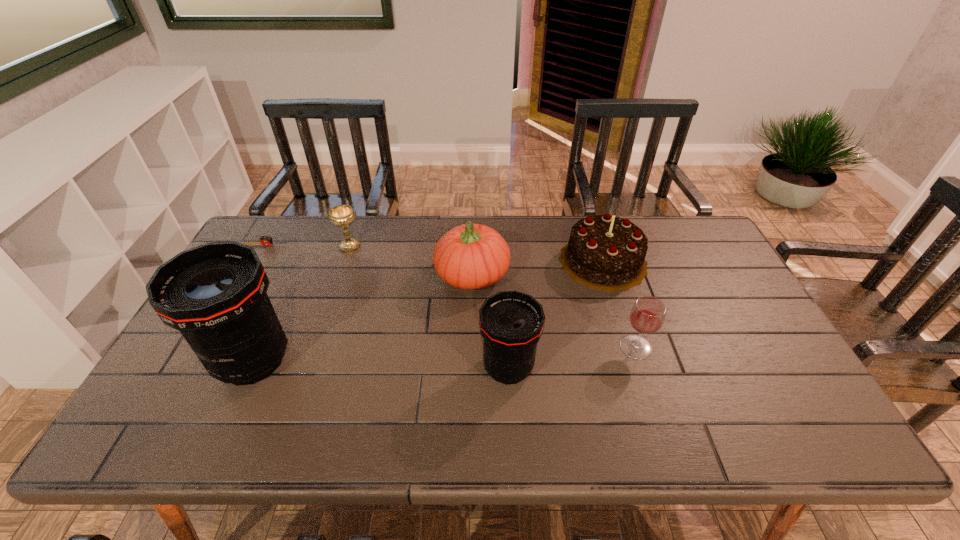
I want to click on the left telephoto lens, so click(215, 294).

Image resolution: width=960 pixels, height=540 pixels. Identify the location of the taller telephoto lens. (215, 294).

This screenshot has width=960, height=540. Find the location of `the shorter telephoto lens`. the shorter telephoto lens is located at coordinates (511, 323).

Identify the location of the shortest object. (265, 240).

This screenshot has width=960, height=540. I want to click on birthday cake, so click(604, 252).

Identify the location of chalice. The image size is (960, 540). (342, 216).

Locate an element on the screen. The image size is (960, 540). pumpkin is located at coordinates (470, 256).

Find the location of a particular element. This screenshot has width=960, height=540. wineglass is located at coordinates (647, 316).

Find the location of `vacant space located on the left of the tallest object`. vacant space located on the left of the tallest object is located at coordinates (182, 361).

Find the location of a particular element. Image resolution: width=960 pixels, height=540 pixels. vacant area situated on the left of the shorter telephoto lens is located at coordinates (355, 368).